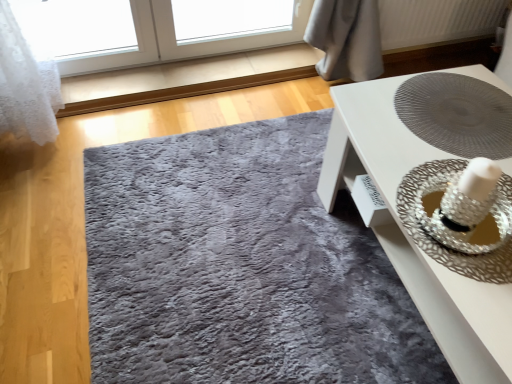
What do you see at coordinates (241, 267) in the screenshot?
I see `shaggy gray rug at center` at bounding box center [241, 267].

The height and width of the screenshot is (384, 512). What are the coordinates of `shaggy gray rug at center` in the screenshot? It's located at (241, 267).

Image resolution: width=512 pixels, height=384 pixels. I want to click on white glossy table at center, so click(410, 237).

The image size is (512, 384). Describe the element at coordinates (461, 216) in the screenshot. I see `silver metallic straw hat at right` at that location.

The image size is (512, 384). Describe the element at coordinates (436, 21) in the screenshot. I see `white textured radiator at upper right` at that location.

I want to click on shaggy gray rug at center, so click(241, 267).

From the image's perspective, is white glossy table at center above white textured radiator at upper right?

No, from the image's perspective, white glossy table at center is not over white textured radiator at upper right.

Consider the image. Which object is positioned more to the right, white glossy table at center or white textured radiator at upper right?

From the viewer's perspective, white textured radiator at upper right appears more on the right side.

Is white glossy table at center bigger or smaller than white textured radiator at upper right?

Clearly, white glossy table at center is larger in size than white textured radiator at upper right.

Image resolution: width=512 pixels, height=384 pixels. What are the coordinates of `table below the white textured radiator at upper right (from the image's perspective)` in the screenshot? It's located at (410, 237).

Does white textured radiator at upper right have a lesser width compared to silver metallic straw hat at right?

Yes.

Is white textured radiator at upper right surrounding silver metallic straw hat at right?

Actually, silver metallic straw hat at right is outside white textured radiator at upper right.

Is the depth of white textured radiator at upper right greater than that of silver metallic straw hat at right?

Yes, it is.

Is silver metallic straw hat at right to the left of white textured radiator at upper right from the viewer's perspective?

Yes.

Considering the sizes of silver metallic straw hat at right and white textured radiator at upper right in the image, is silver metallic straw hat at right bigger or smaller than white textured radiator at upper right?

Considering their sizes, silver metallic straw hat at right takes up less space than white textured radiator at upper right.

Is silver metallic straw hat at right taller or shorter than white textured radiator at upper right?

Considering their sizes, silver metallic straw hat at right has less height than white textured radiator at upper right.

You are a GUI agent. You are given a task and a screenshot of the screen. Output one action in this format:
    pyautogui.click(x=<x>, y=<y>)
    Task: Click on the straw hat below the white textured radiator at upper right (from the image's perspective)
    
    Given the screenshot: What is the action you would take?
    pyautogui.click(x=461, y=216)

Could you tell me if silver metallic straw hat at right is turned towards white glossy table at center?

Yes, silver metallic straw hat at right is facing white glossy table at center.

Based on the photo, is silver metallic straw hat at right wider than white glossy table at center?

No, silver metallic straw hat at right is not wider than white glossy table at center.

Is silver metallic straw hat at right in front of white glossy table at center?

No, the depth of silver metallic straw hat at right is greater than that of white glossy table at center.

Where is `mat behind the silver metallic straw hat at right`? The height and width of the screenshot is (384, 512). mat behind the silver metallic straw hat at right is located at coordinates (241, 267).

Are shaggy gray rug at center and silver metallic straw hat at right making contact?

No, shaggy gray rug at center is not with silver metallic straw hat at right.

Choose the correct answer: Is shaggy gray rug at center inside silver metallic straw hat at right or outside it?

shaggy gray rug at center is located beyond the bounds of silver metallic straw hat at right.

Which object is further away from the camera, shaggy gray rug at center or silver metallic straw hat at right?

Positioned behind is shaggy gray rug at center.

From a real-world perspective, relative to shaggy gray rug at center, is white glossy table at center vertically above or below?

In terms of real-world spatial position, white glossy table at center is above shaggy gray rug at center.

Can you tell me how much white glossy table at center and shaggy gray rug at center differ in facing direction?

The facing directions of white glossy table at center and shaggy gray rug at center are 90.9 degrees apart.

Considering the sizes of objects white glossy table at center and shaggy gray rug at center in the image provided, who is bigger, white glossy table at center or shaggy gray rug at center?

white glossy table at center.

Is shaggy gray rug at center at the back of white glossy table at center?

white glossy table at center does not have its back to shaggy gray rug at center.

Is silver metallic straw hat at right oriented away from shaggy gray rug at center?

No, shaggy gray rug at center is not at the back of silver metallic straw hat at right.

Where is `straw hat in front of the shaggy gray rug at center`? Image resolution: width=512 pixels, height=384 pixels. straw hat in front of the shaggy gray rug at center is located at coordinates (461, 216).

Visually, is silver metallic straw hat at right positioned to the left or to the right of shaggy gray rug at center?

silver metallic straw hat at right is positioned on shaggy gray rug at center's right side.

Is silver metallic straw hat at right thinner than shaggy gray rug at center?

Yes.

The height and width of the screenshot is (384, 512). Identify the location of table that appears in front of the white textured radiator at upper right. (410, 237).

Find the location of a particular element. This screenshot has height=384, width=512. radiator above the silver metallic straw hat at right (from the image's perspective) is located at coordinates (436, 21).

When comparing their distances from silver metallic straw hat at right, does shaggy gray rug at center or white textured radiator at upper right seem further?

white textured radiator at upper right is positioned further to the anchor silver metallic straw hat at right.

Looking at the image, which one is located closer to shaggy gray rug at center, white textured radiator at upper right or silver metallic straw hat at right?

silver metallic straw hat at right lies closer to shaggy gray rug at center than the other object.

Which object lies further to the anchor point white glossy table at center, silver metallic straw hat at right or shaggy gray rug at center?

shaggy gray rug at center is positioned further to the anchor white glossy table at center.

Looking at the image, which one is located further to white glossy table at center, silver metallic straw hat at right or white textured radiator at upper right?

white textured radiator at upper right is further to white glossy table at center.

From the image, which object appears to be farther from shaggy gray rug at center, white glossy table at center or silver metallic straw hat at right?

silver metallic straw hat at right is positioned further to the anchor shaggy gray rug at center.

Looking at the image, which one is located further to shaggy gray rug at center, silver metallic straw hat at right or white textured radiator at upper right?

white textured radiator at upper right is positioned further to the anchor shaggy gray rug at center.

Which object lies further to the anchor point white textured radiator at upper right, white glossy table at center or silver metallic straw hat at right?

silver metallic straw hat at right is positioned further to the anchor white textured radiator at upper right.

Considering their positions, is shaggy gray rug at center positioned closer to white glossy table at center than white textured radiator at upper right?

Among the two, shaggy gray rug at center is located nearer to white glossy table at center.

Find the location of `straw hat between white textured radiator at upper right and shaggy gray rug at center from top to bottom`. straw hat between white textured radiator at upper right and shaggy gray rug at center from top to bottom is located at coordinates (461, 216).

I want to click on straw hat between white glossy table at center and white textured radiator at upper right in the front-back direction, so click(x=461, y=216).

Locate an element on the screen. The image size is (512, 384). straw hat between shaggy gray rug at center and white glossy table at center is located at coordinates (461, 216).

The image size is (512, 384). What are the coordinates of `table between white textured radiator at upper right and shaggy gray rug at center vertically` in the screenshot? It's located at tap(410, 237).